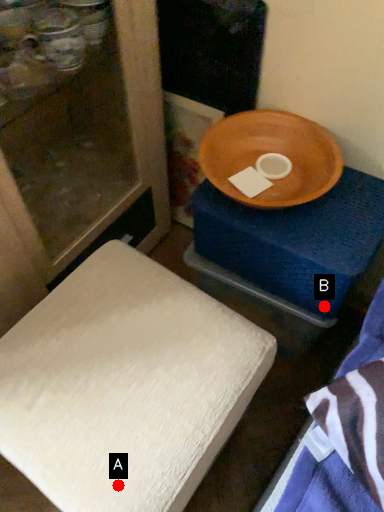
Question: Two points are circled on the image, labeled by A and B beside each circle. Which point is closer to the camera taking this photo?

Choices:
 (A) A is closer
 (B) B is closer

Answer: (A)